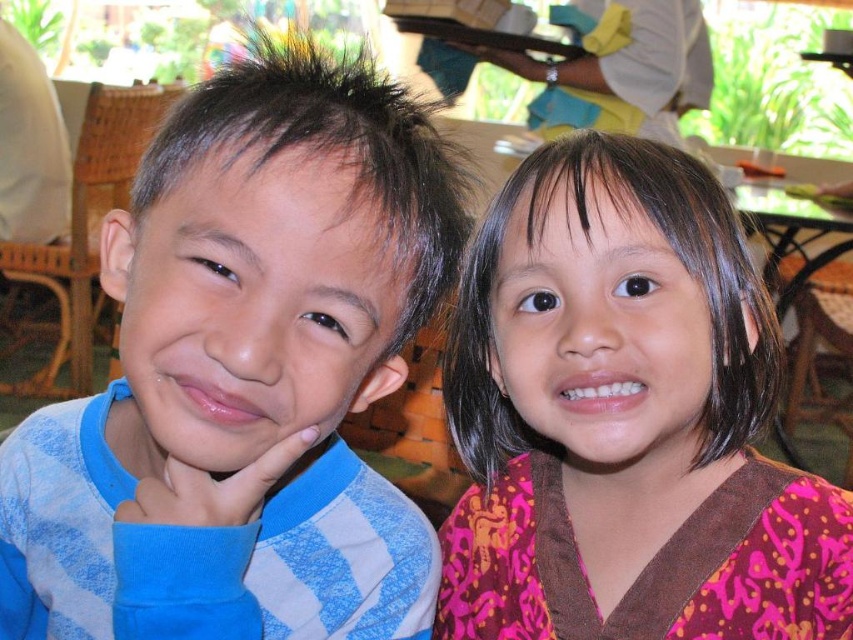
Question: Which point is farther to the camera?

Choices:
 (A) blue striped shirt at left
 (B) pink fabric at upper right
 (C) white cloth at upper center

Answer: (C)

Question: Does pink fabric at upper right have a greater width compared to white cloth at upper center?

Choices:
 (A) no
 (B) yes

Answer: (A)

Question: Which object is farther from the camera taking this photo?

Choices:
 (A) white cloth at upper center
 (B) pink fabric at upper right

Answer: (A)

Question: Which point is farther to the camera?

Choices:
 (A) (698, 84)
 (B) (766, 317)
 (C) (318, 442)

Answer: (A)

Question: Does blue striped shirt at left appear under white cloth at upper center?

Choices:
 (A) no
 (B) yes

Answer: (B)

Question: Is blue striped shirt at left positioned in front of pink fabric at upper right?

Choices:
 (A) no
 (B) yes

Answer: (B)